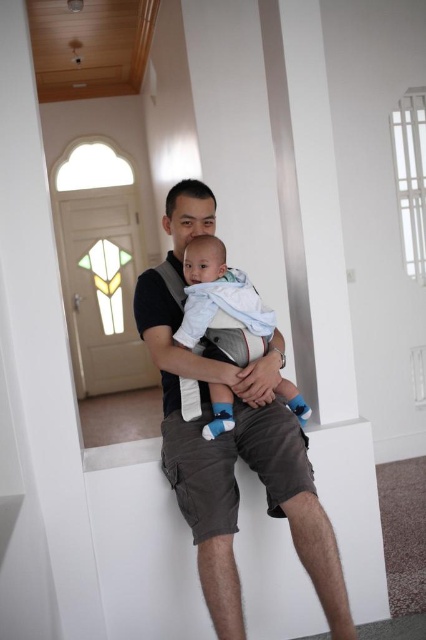
Question: Is dark gray cotton shirt at center closer to camera compared to light blue fabric baby at center?

Choices:
 (A) yes
 (B) no

Answer: (A)

Question: Is dark gray cotton shirt at center wider than light blue fabric baby at center?

Choices:
 (A) no
 (B) yes

Answer: (B)

Question: Can you confirm if dark gray cotton shirt at center is bigger than light blue fabric baby at center?

Choices:
 (A) no
 (B) yes

Answer: (B)

Question: Which object is farther from the camera taking this photo?

Choices:
 (A) dark gray cotton shirt at center
 (B) light blue fabric baby at center

Answer: (B)

Question: Which point is closer to the camera?

Choices:
 (A) (198, 456)
 (B) (256, 321)

Answer: (A)

Question: Which of the following is the closest to the observer?

Choices:
 (A) dark gray cotton shirt at center
 (B) light blue fabric baby at center

Answer: (A)